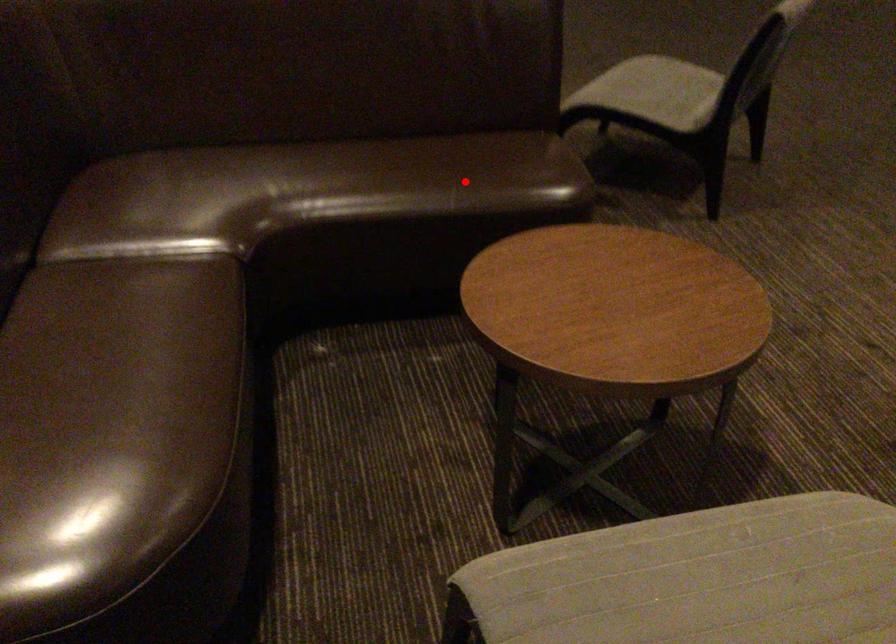
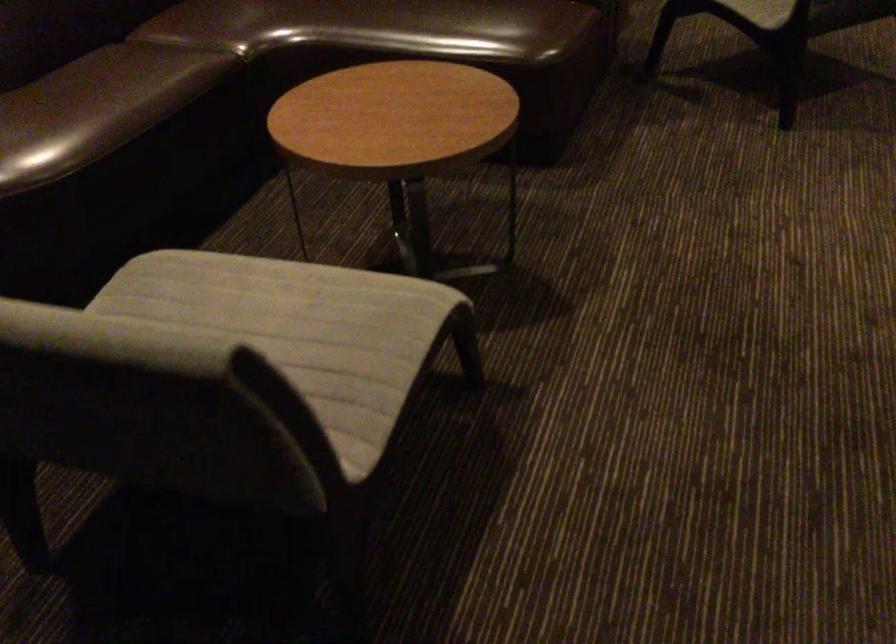
Find the pixel in the second image that matches the highlighted location in the first image.

(444, 26)